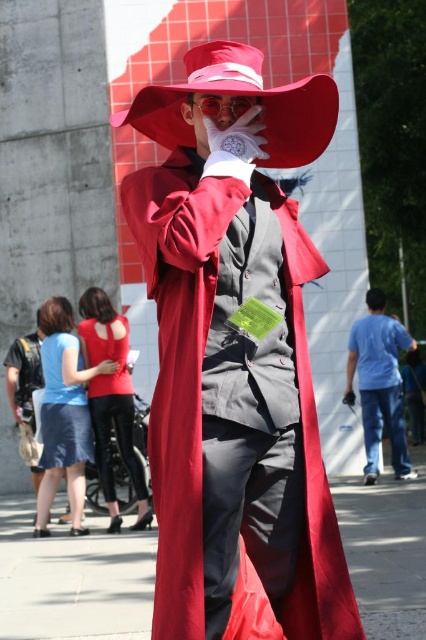
Question: Is blue cotton shirt at right to the right of matte black suit at center from the viewer's perspective?

Choices:
 (A) no
 (B) yes

Answer: (B)

Question: Which point appears closest to the camera in this image?

Choices:
 (A) (229, 102)
 (B) (382, 340)

Answer: (A)

Question: Does shiny red goggles at center come in front of matte black suit at center?

Choices:
 (A) yes
 (B) no

Answer: (A)

Question: Does matte red cape at center have a greater width compared to matte red cowboy hat at center?

Choices:
 (A) yes
 (B) no

Answer: (B)

Question: Which object is positioned closest to the matte red cape at center?

Choices:
 (A) matte red cowboy hat at center
 (B) matte black suit at center
 (C) shiny red goggles at center

Answer: (C)

Question: Which point appears closest to the camera in this image?

Choices:
 (A) (241, 96)
 (B) (13, 378)
 (C) (374, 307)

Answer: (A)